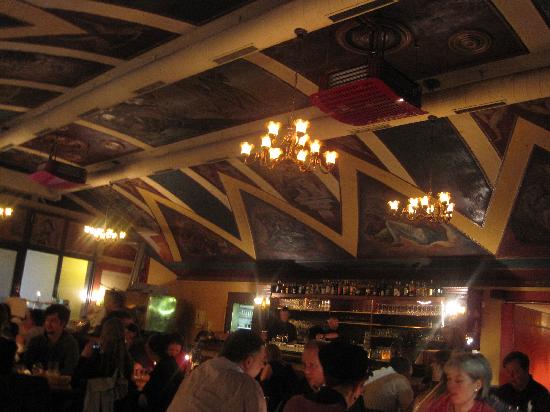
What are the coordinates of `chair` in the screenshot? It's located at (15, 307).